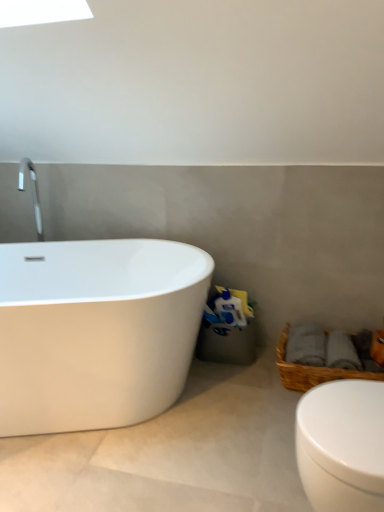
This screenshot has width=384, height=512. In order to click on free point above white glossy toilet at lower right (from a real-world perspective) in this screenshot , I will do `click(350, 412)`.